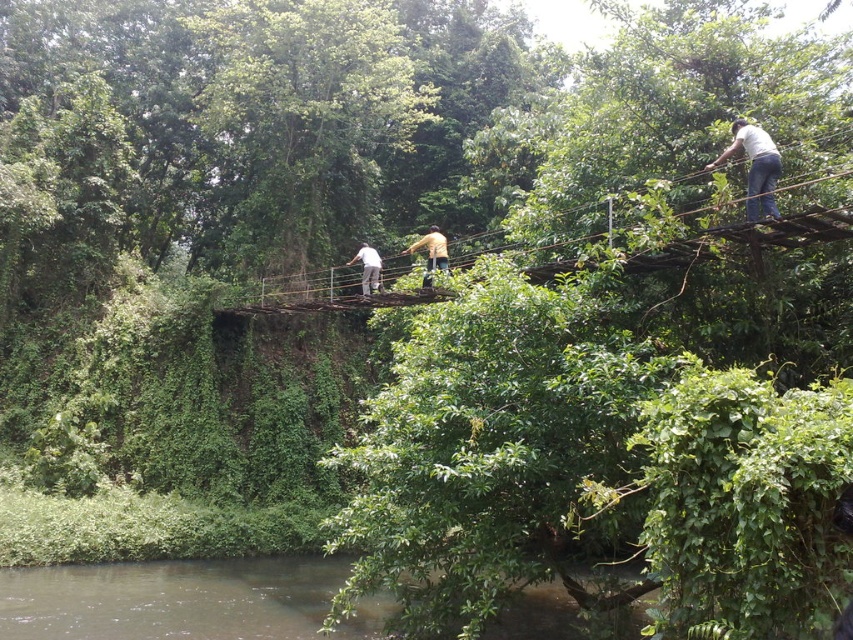
You are standing on the rustic suspension bridge and notice two points marked on the walkway. The first point is at coordinates point (548, 276) and the second is at point (433, 269). Which point is closer to you as you face the direction of the bridge?

Point (548, 276) is in front of point (433, 269), so it is closer to you when facing the bridge.

You are standing on the suspension bridge and notice the brown murky water at lower left and the white matte shirt at center. Which object is positioned to the left of the other?

The brown murky water at lower left is to the left of the white matte shirt at center.